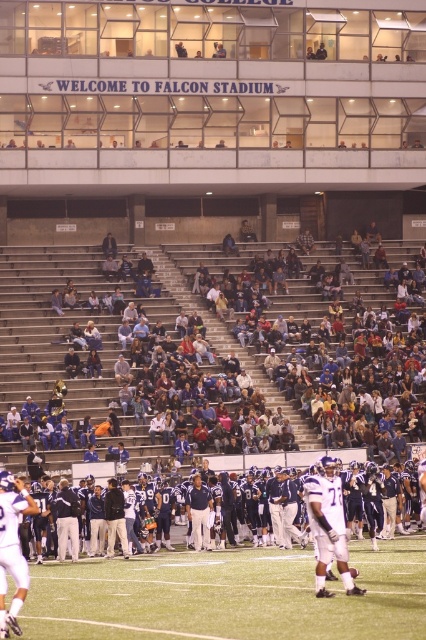
Question: Is blue fabric seats at center to the left of green turf at center from the viewer's perspective?

Choices:
 (A) no
 (B) yes

Answer: (A)

Question: Observing the image, what is the correct spatial positioning of blue fabric seats at center in reference to green turf at center?

Choices:
 (A) above
 (B) below

Answer: (A)

Question: Does blue fabric seats at center have a greater width compared to green turf at center?

Choices:
 (A) no
 (B) yes

Answer: (B)